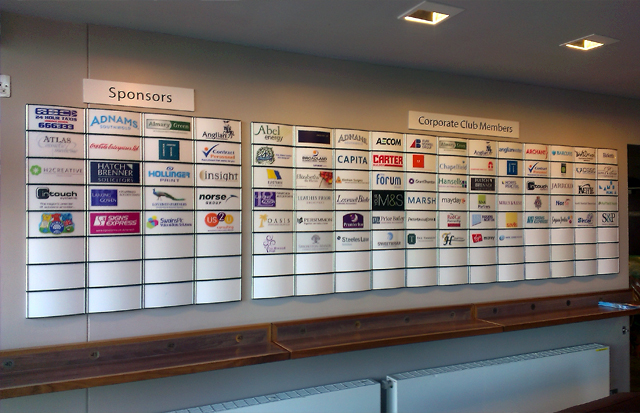
At what (x,y) coordinates should I click in order to perform the action: click on wooden short desk. Please return your answer as a coordinate pair (x, y). This screenshot has height=413, width=640. Looking at the image, I should click on (330, 333), (116, 344).